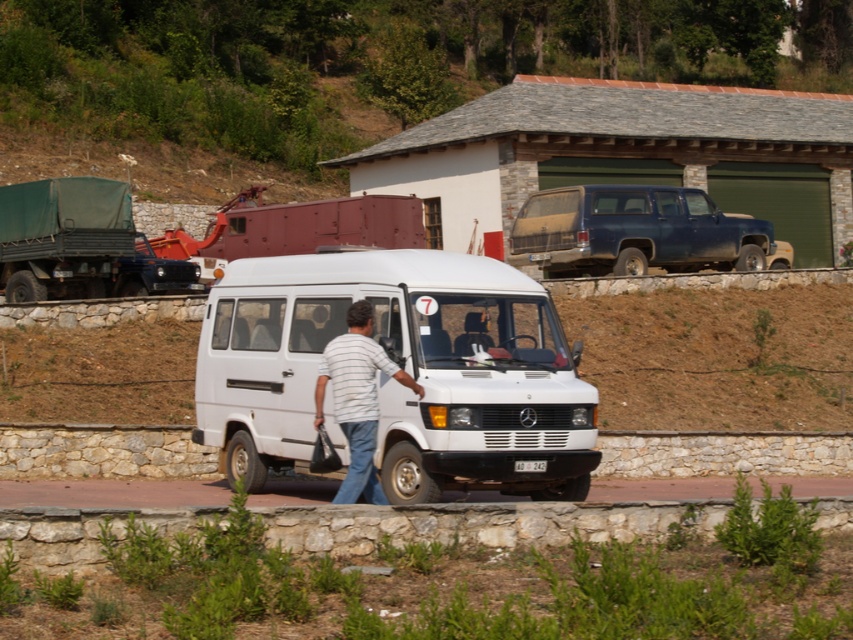
You are standing at the point marked by the coordinates point [479,524]. What object are you standing on?

The point [479,524] marks the stone curb at lower center, so you are standing on the stone curb at lower center.

Consider the image. You are a delivery driver who needs to park your vehicle in the parking lot shown in the image. You have a truck that is as tall as the striped fabric shirt at center. Can you safely park your truck in the same spot as the dirty matte blue truck at upper right without hitting the roof?

The dirty matte blue truck at upper right is much taller than the striped fabric shirt at center. Since your truck is as tall as the striped fabric shirt at center, it would be shorter than the dirty matte blue truck at upper right. Therefore, you can safely park your truck in the same spot without hitting the roof.

You are standing at the center of the image and want to walk to the dirty matte blue truck at upper right. Which direction should you move in relative to the striped fabric shirt at center?

You should move to the right of the striped fabric shirt at center to reach the dirty matte blue truck at upper right.